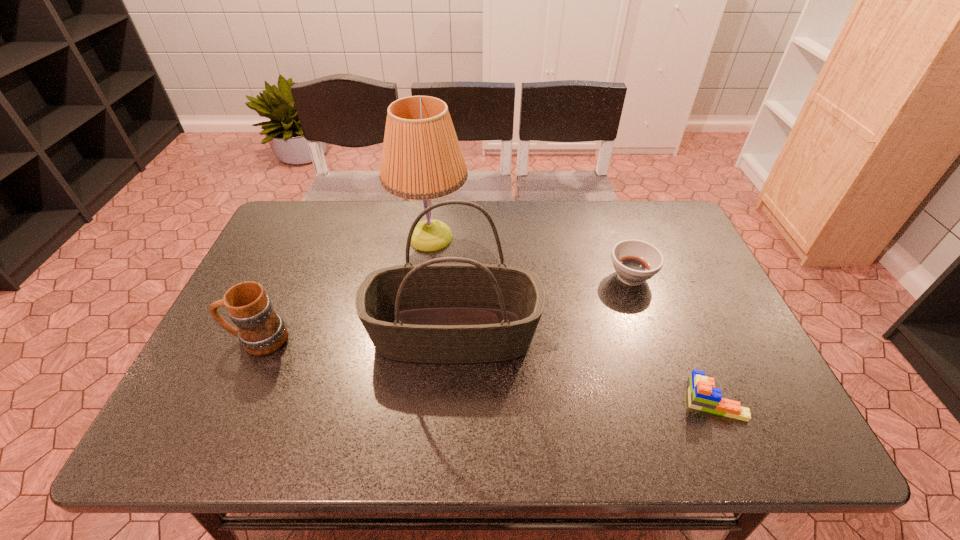
Locate an element on the screen. object situated at the far edge is located at coordinates (421, 159).

Identify the location of object that is at the near edge. (702, 395).

You are a GUI agent. You are given a task and a screenshot of the screen. Output one action in this format:
    pyautogui.click(x=<x>, y=<y>)
    Task: Click on the object situated at the left edge
    
    Given the screenshot: What is the action you would take?
    pyautogui.click(x=261, y=331)

The image size is (960, 540). I want to click on soup bowl that is at the right edge, so click(635, 261).

This screenshot has height=540, width=960. I want to click on Lego present at the right edge, so click(702, 395).

Identify the location of object situated at the near right corner. The height and width of the screenshot is (540, 960). (702, 395).

In the image, there is a desktop. At what (x,y) coordinates should I click in order to perform the action: click on vacant space at the far edge. Please return your answer as a coordinate pair (x, y). The width and height of the screenshot is (960, 540). Looking at the image, I should click on coord(456,205).

This screenshot has width=960, height=540. What are the coordinates of `vacant point at the near edge` in the screenshot? It's located at (256, 428).

Where is `blank space at the left edge of the desktop`? The image size is (960, 540). blank space at the left edge of the desktop is located at coordinates (x=276, y=292).

The image size is (960, 540). In the image, there is a desktop. Find the location of `free space at the far left corner`. free space at the far left corner is located at coordinates (310, 216).